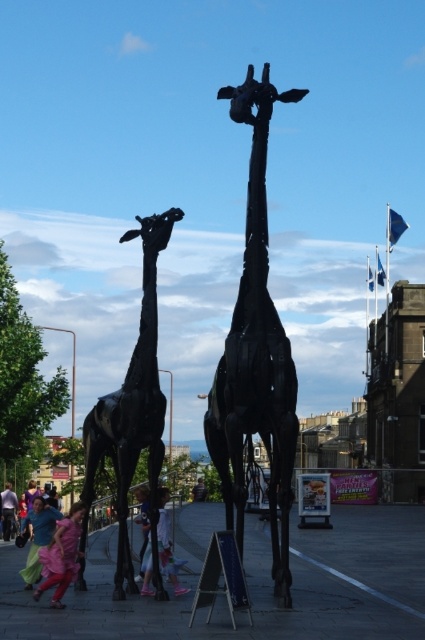
Question: Is matte pink dress at lower left thinner than pink fabric pants at lower center?

Choices:
 (A) no
 (B) yes

Answer: (B)

Question: Which point is farther to the camera?

Choices:
 (A) (73, 540)
 (B) (10, 484)
 (C) (71, 435)

Answer: (C)

Question: Which point is farther to the camera?

Choices:
 (A) (16, 502)
 (B) (254, 266)

Answer: (A)

Question: Is matte blue dress at lower left smaller than pink fabric at lower left?

Choices:
 (A) no
 (B) yes

Answer: (A)

Question: Considering the real-world distances, which object is closest to the pink fabric at lower center?

Choices:
 (A) brushed metal pole at left
 (B) black matte giraffe at left
 (C) black metal giraffe at center
 (D) pink fabric at lower left

Answer: (D)

Question: Does matte pink dress at lower left appear on the right side of pink fabric at lower left?

Choices:
 (A) yes
 (B) no

Answer: (A)